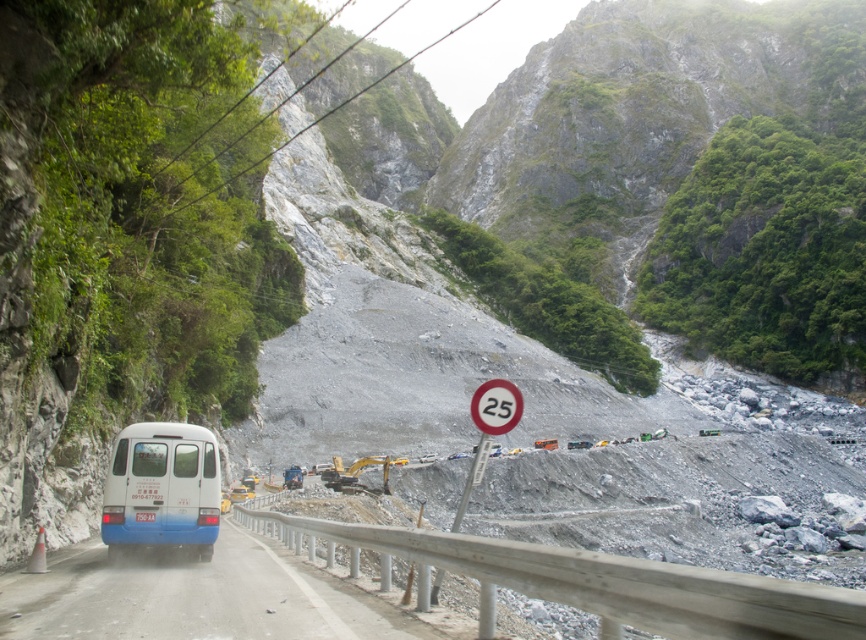
Question: Is blue matte bus at left thinner than white plastic speed limit sign at center?

Choices:
 (A) yes
 (B) no

Answer: (A)

Question: Which of the following is the farthest from the observer?

Choices:
 (A) white plastic speed limit sign at center
 (B) blue matte bus at left

Answer: (B)

Question: Is blue matte bus at left wider than white plastic speed limit sign at center?

Choices:
 (A) yes
 (B) no

Answer: (B)

Question: Is blue matte bus at left positioned behind white plastic speed limit sign at center?

Choices:
 (A) yes
 (B) no

Answer: (A)